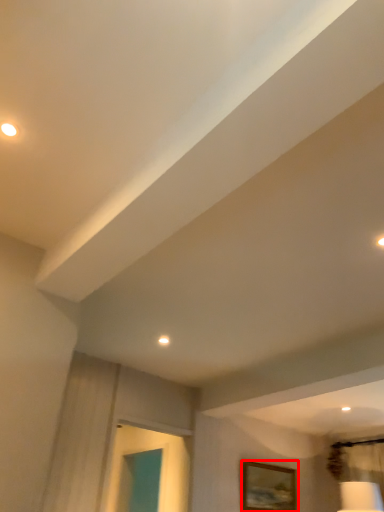
Question: Observing the image, what is the correct spatial positioning of picture frame (annotated by the red box) in reference to droplight?

Choices:
 (A) left
 (B) right

Answer: (B)